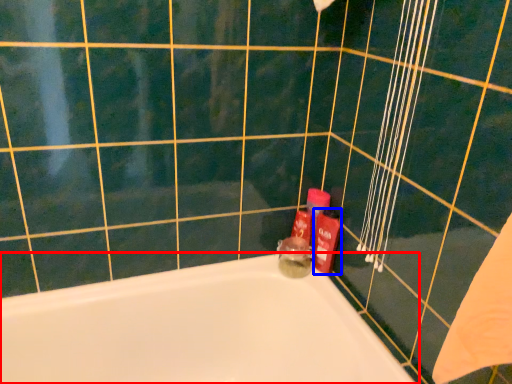
Question: Which object appears farthest to the camera in this image, bathtub (highlighted by a red box) or toiletry (highlighted by a blue box)?

Choices:
 (A) bathtub
 (B) toiletry

Answer: (B)